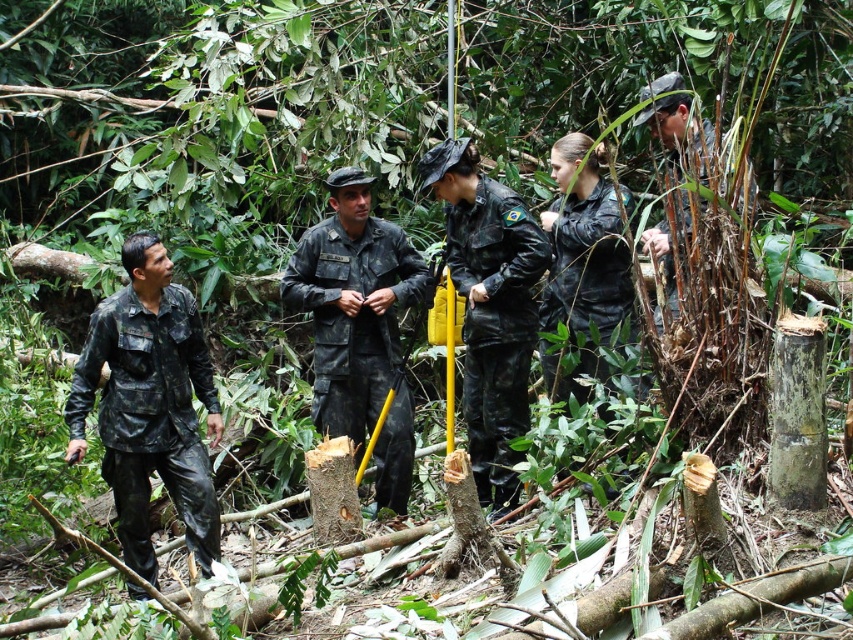
You are a member of the group in the forest. You need to determine which uniform has a wider torso area. Which one is wider between the camouflage fabric uniform at center and the black matte uniform at center?

The camouflage fabric uniform at center has a larger width than the black matte uniform at center, so the camouflage fabric uniform at center is wider.

You are a member of the military unit in the forest. You notice two camouflage fabric uniforms in the scene. Which one is closer to the ground, the camouflage fabric uniform at left or the camouflage fabric uniform at center?

The camouflage fabric uniform at left is positioned under camouflage fabric uniform at center, so it is closer to the ground.